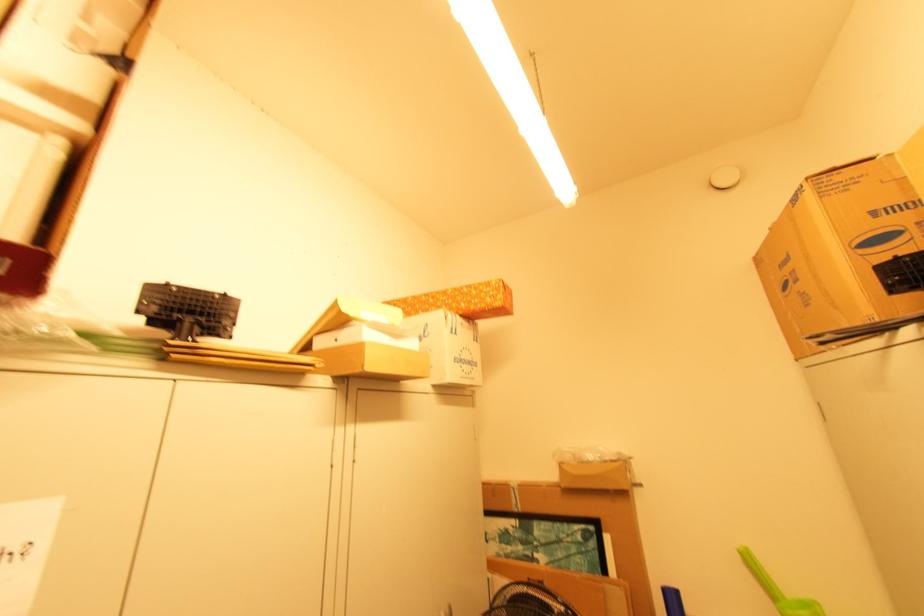
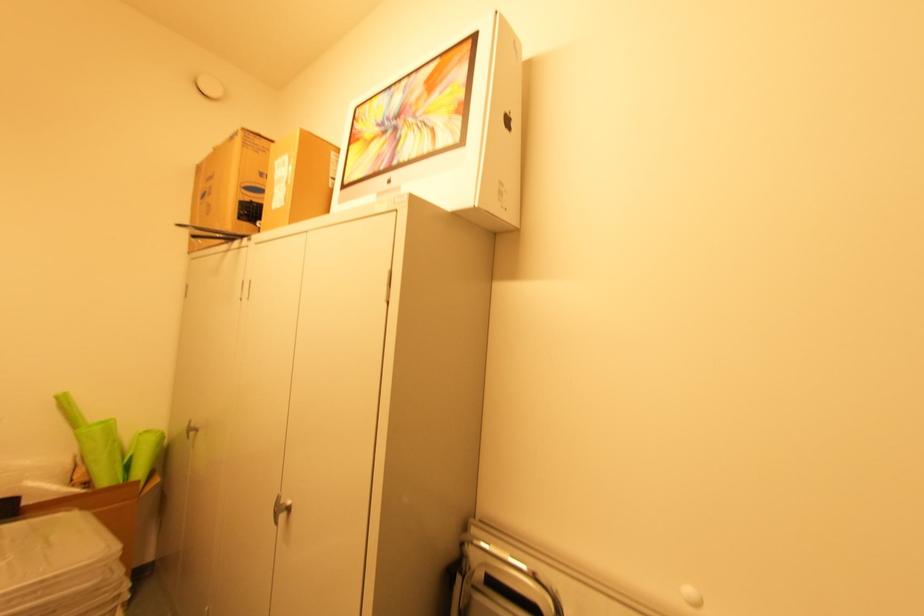
Question: The camera is either moving clockwise (left) or counter-clockwise (right) around the object. The first image is from the beginning of the video and the second image is from the end. Is the camera moving left or right when shooting the video?

Choices:
 (A) Left
 (B) Right

Answer: (A)